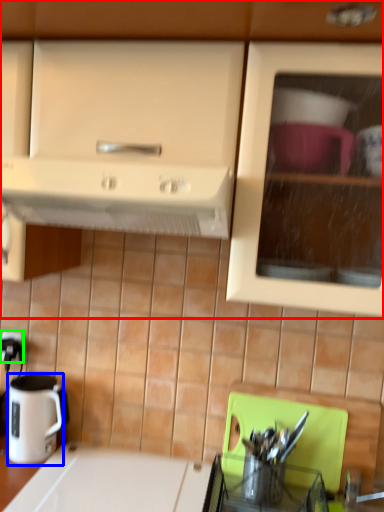
Question: Based on their relative distances, which object is farther from cabinetry (highlighted by a red box)? Choose from coffee cup (highlighted by a blue box) and electric outlet (highlighted by a green box).

Choices:
 (A) coffee cup
 (B) electric outlet

Answer: (B)